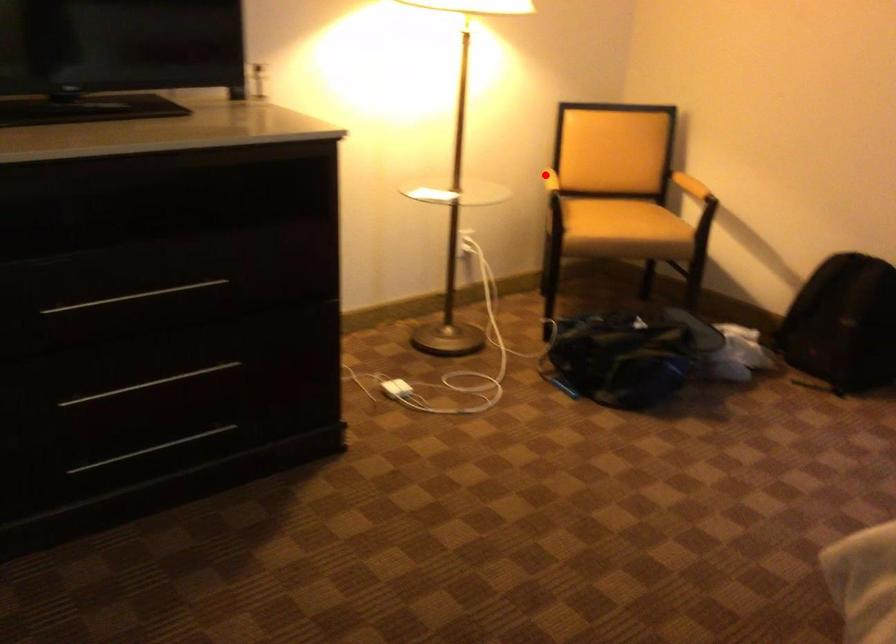
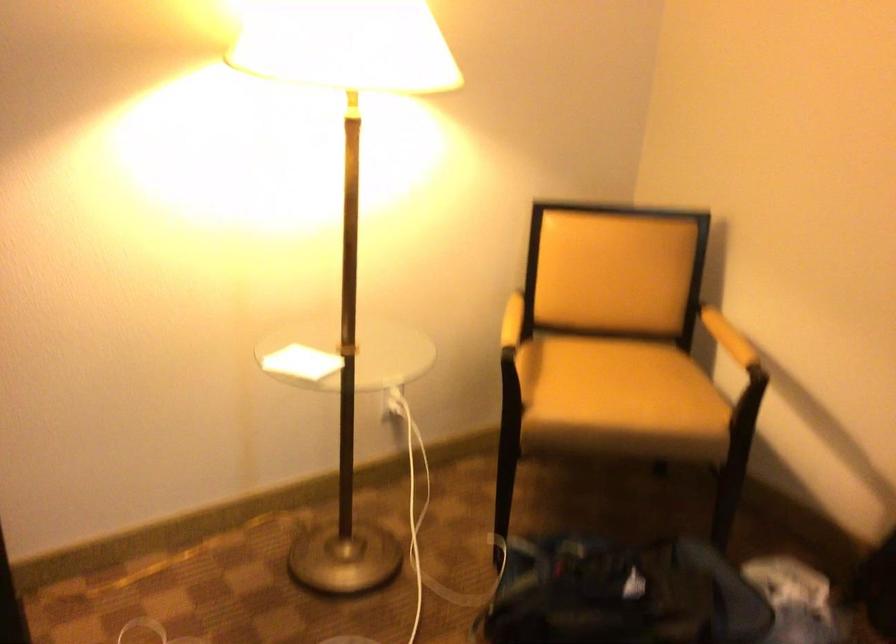
Find the pixel in the second image that matches the highlighted location in the first image.

(512, 321)